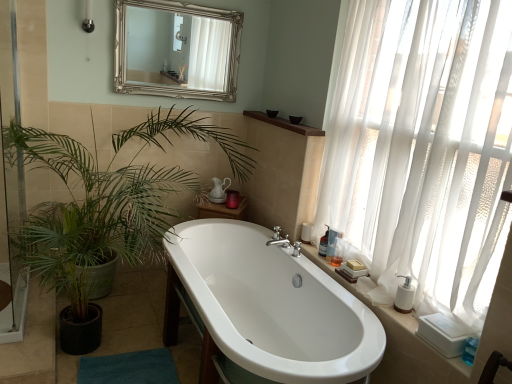
Question: In the image, is white glossy bathtub at center positioned in front of or behind transparent glass screen door at left?

Choices:
 (A) behind
 (B) front

Answer: (B)

Question: Based on their positions, is white glossy bathtub at center located to the left or right of transparent glass screen door at left?

Choices:
 (A) right
 (B) left

Answer: (A)

Question: Which object is the closest to the transparent glass screen door at left?

Choices:
 (A) blue fabric bath mat at lower left
 (B) silver/gilded mirror at upper center
 (C) translucent plastic bottle at right, arranged as the 3th toiletry when viewed from the back
 (D) white glossy bathtub at center
 (E) green leafy plant at upper left

Answer: (E)

Question: Estimate the real-world distances between objects in this image. Which object is closer to the silver/gilded mirror at upper center?

Choices:
 (A) transparent glass screen door at left
 (B) white plastic soap dispenser at right, which appears as the 2th toiletry when viewed from the front
 (C) brown wood shelf at upper center
 (D) white glossy bathtub at center
 (E) blue fabric bath mat at lower left

Answer: (C)